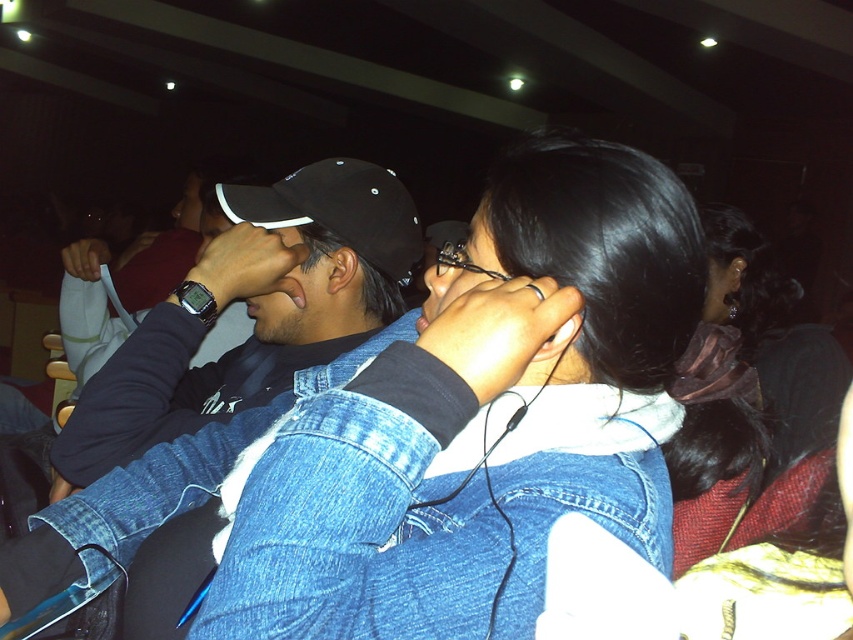
Between point (293, 600) and point (399, 276), which one is positioned behind?

The point (399, 276) is more distant.

Measure the distance from denim jacket at center to black matte baseball cap at center.

21.73 inches

Is point (440, 564) positioned after point (230, 205)?

No.

Image resolution: width=853 pixels, height=640 pixels. Find the location of `denim jacket at center`. denim jacket at center is located at coordinates (479, 419).

In order to click on black matte cap at upper left in this screenshot , I will do `click(252, 310)`.

Measure the distance between point [299,225] and camera.

A: Point [299,225] and camera are 4.09 feet apart from each other.

Between point (160, 397) and point (366, 193), which one is positioned in front?

Point (160, 397) is more forward.

The height and width of the screenshot is (640, 853). In order to click on black matte cap at upper left in this screenshot , I will do (x=252, y=310).

Who is positioned more to the left, black satin hair at center or black matte baseball cap at center?

Positioned to the left is black matte baseball cap at center.

Is black satin hair at center in front of black matte baseball cap at center?

Yes.

Describe the element at coordinates (763, 397) in the screenshot. I see `black satin hair at center` at that location.

Locate an element on the screen. This screenshot has height=640, width=853. black satin hair at center is located at coordinates pos(763,397).